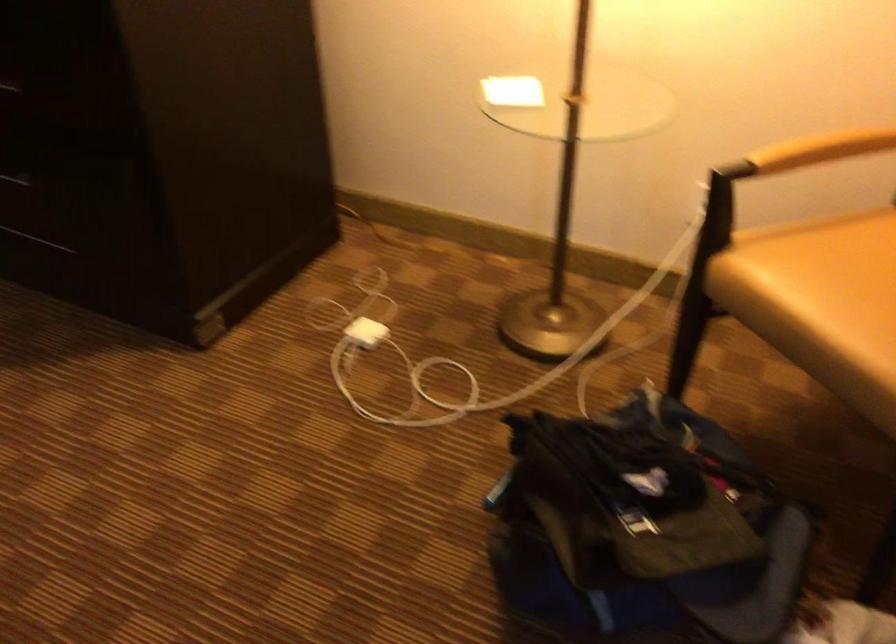
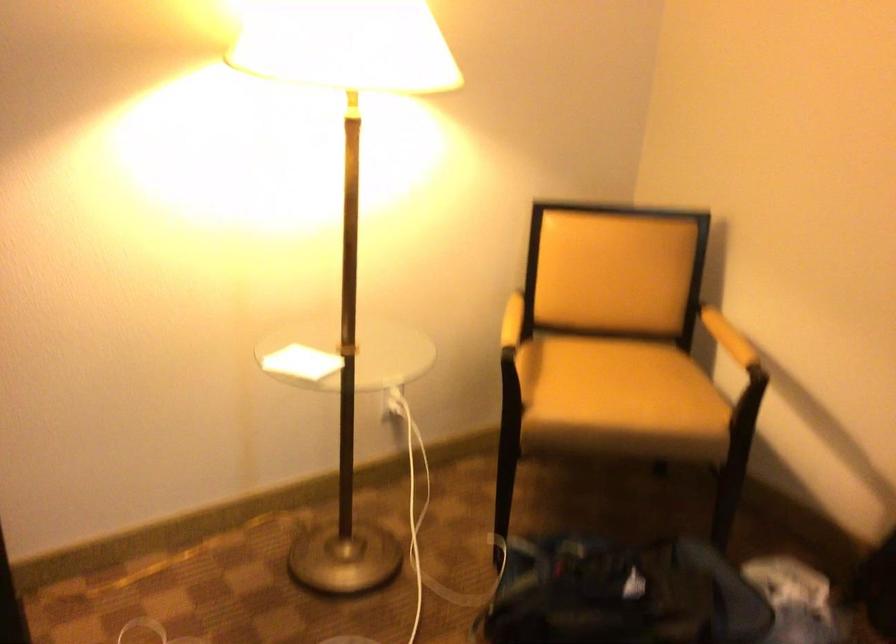
The point at (514, 96) is marked in the first image. Where is the corresponding point in the second image?

(300, 363)